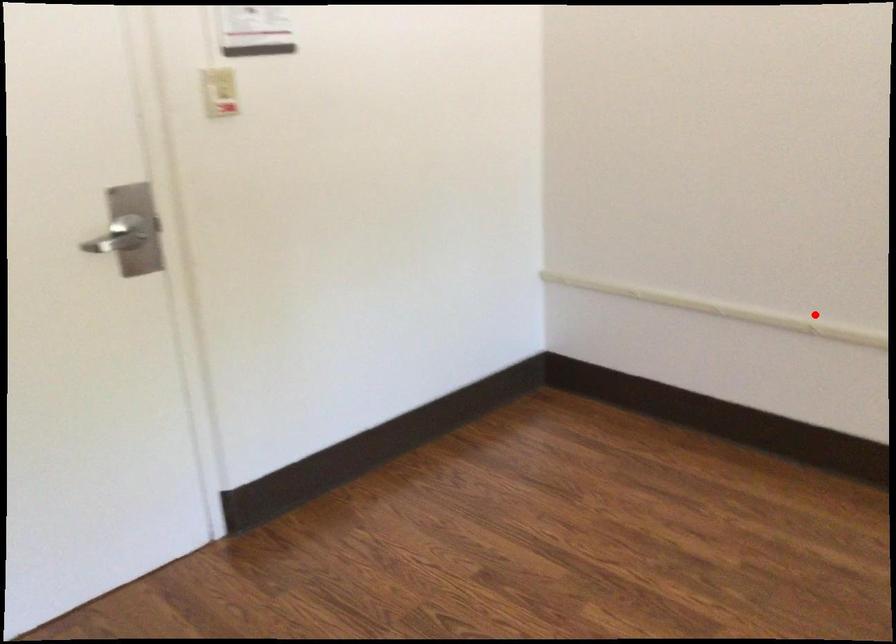
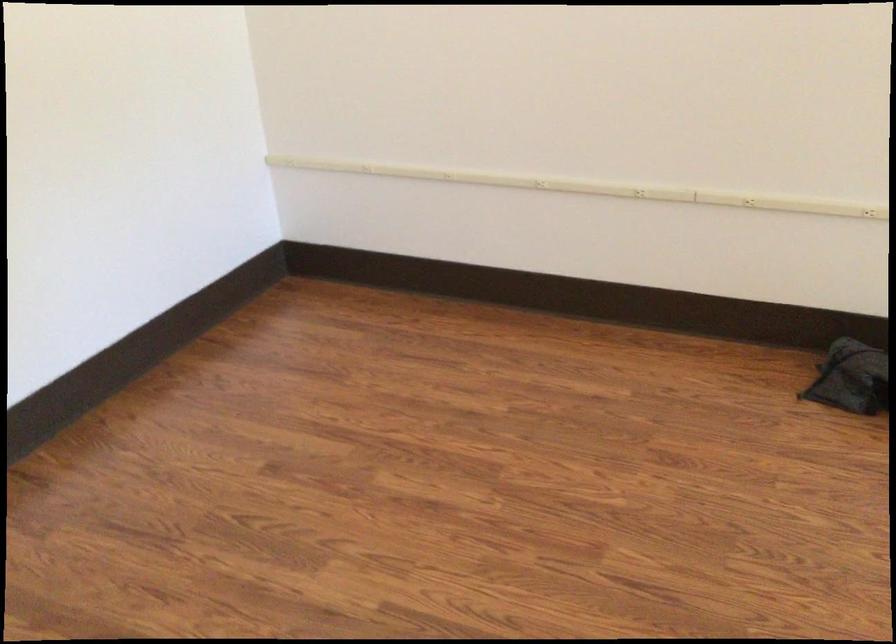
Find the pixel in the second image that matches the highlighted location in the first image.

(538, 171)